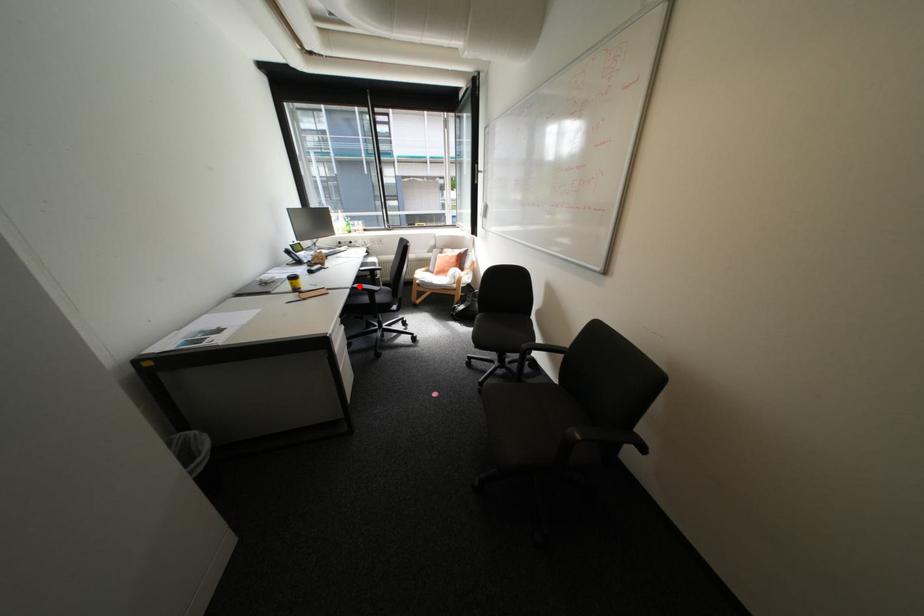
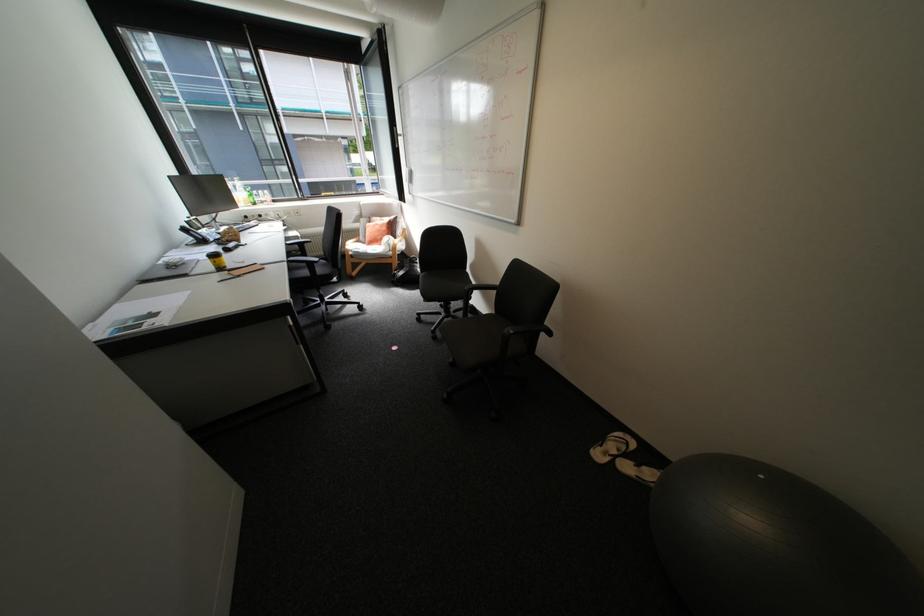
Where in the second image is the point corresponding to the highlighted location from the first image?

(295, 259)